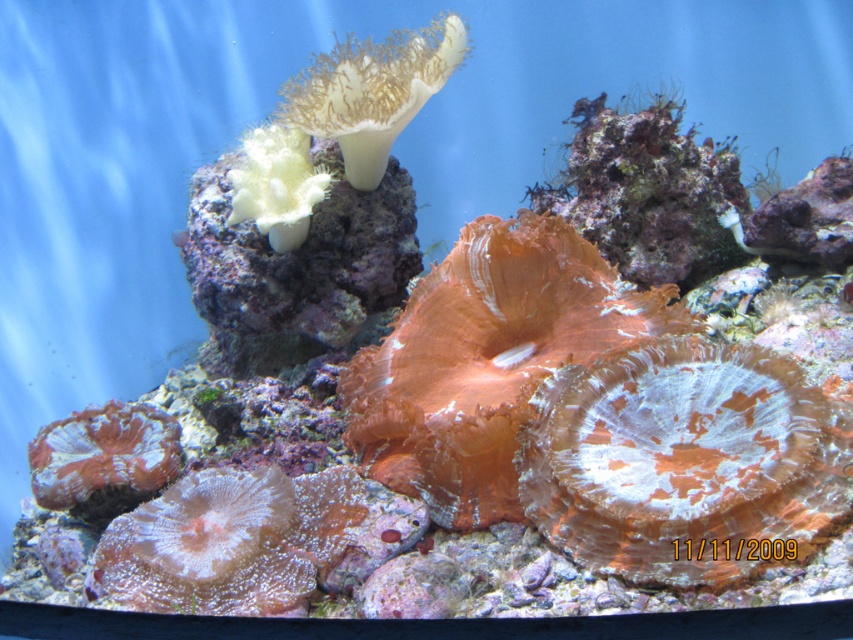
Does translucent coral at lower left have a larger size compared to white soft coral at upper center?

Actually, translucent coral at lower left might be smaller than white soft coral at upper center.

Based on the photo, which is more to the left, translucent coral at lower left or white soft coral at upper center?

translucent coral at lower left is more to the left.

The height and width of the screenshot is (640, 853). I want to click on translucent coral at lower left, so click(230, 541).

Measure the distance between point (x=614, y=346) and camera.

Point (x=614, y=346) is 5.56 feet from camera.

Does point (519, 520) come farther from viewer compared to point (339, 136)?

No, (519, 520) is in front of (339, 136).

Locate an element on the screen. This screenshot has width=853, height=640. orange coral at center is located at coordinates (486, 360).

Does orange coral at center have a smaller size compared to orange coral at lower left?

No, orange coral at center is not smaller than orange coral at lower left.

Who is more forward, [503,476] or [171,448]?

Point [503,476]

This screenshot has height=640, width=853. Describe the element at coordinates (486, 360) in the screenshot. I see `orange coral at center` at that location.

Locate an element on the screen. Image resolution: width=853 pixels, height=640 pixels. orange coral at center is located at coordinates (486, 360).